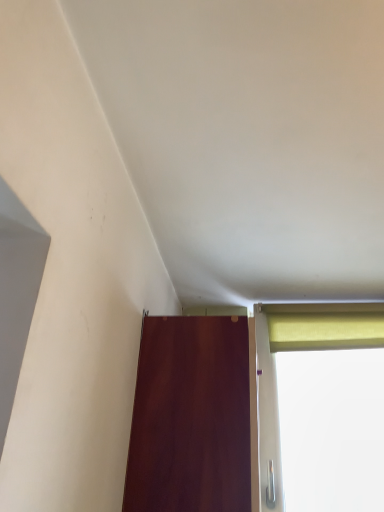
Question: Relative to mahogany wood door at lower center, is yellow fabric curtain at upper right in front or behind?

Choices:
 (A) behind
 (B) front

Answer: (A)

Question: Would you say yellow fabric curtain at upper right is inside or outside mahogany wood door at lower center?

Choices:
 (A) inside
 (B) outside

Answer: (B)

Question: Does point (374, 331) appear closer or farther from the camera than point (152, 349)?

Choices:
 (A) farther
 (B) closer

Answer: (A)

Question: From the image's perspective, is mahogany wood door at lower center above or below yellow fabric curtain at upper right?

Choices:
 (A) above
 (B) below

Answer: (B)

Question: Choose the correct answer: Is mahogany wood door at lower center inside yellow fabric curtain at upper right or outside it?

Choices:
 (A) outside
 (B) inside

Answer: (A)

Question: Does point (248, 359) appear closer or farther from the camera than point (354, 329)?

Choices:
 (A) farther
 (B) closer

Answer: (B)

Question: Is mahogany wood door at lower center taller or shorter than yellow fabric curtain at upper right?

Choices:
 (A) short
 (B) tall

Answer: (B)